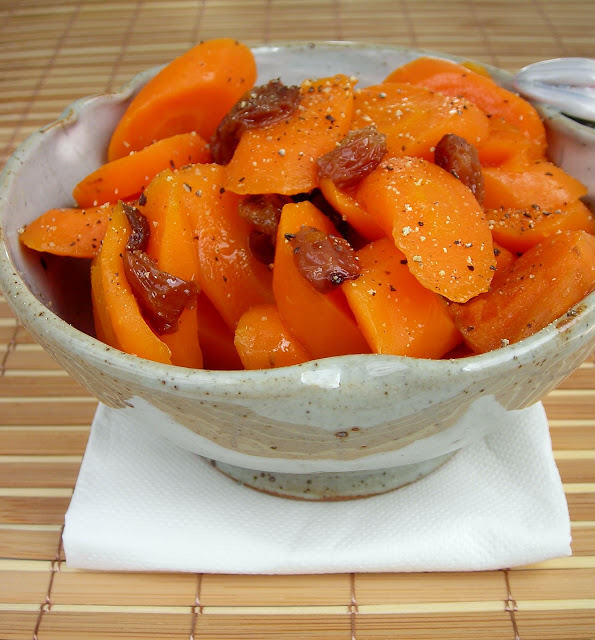
Find the location of a particular element. This screenshot has height=640, width=595. handle of bowl is located at coordinates (574, 70).